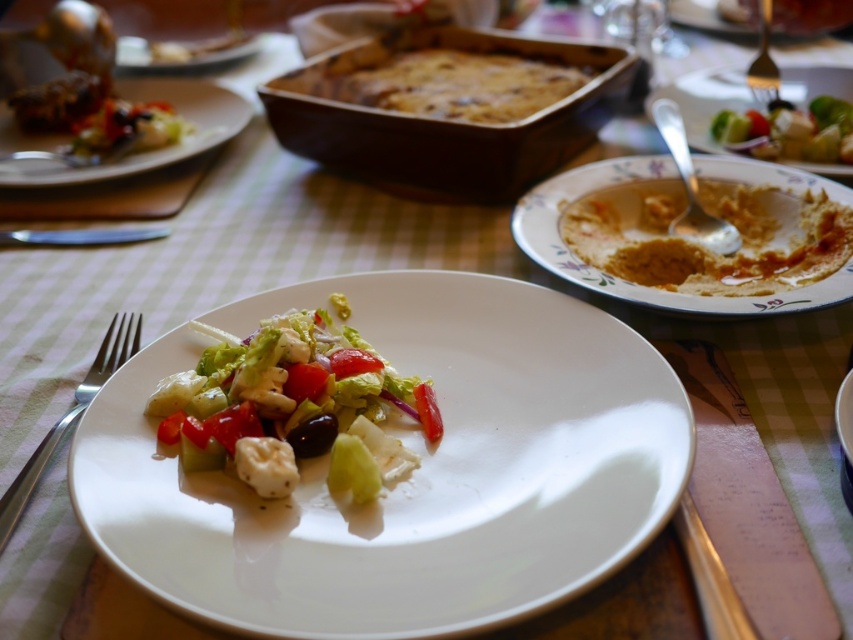
Question: Which point is closer to the camera?

Choices:
 (A) (776, 68)
 (B) (218, 113)
 (C) (676, 156)

Answer: (C)

Question: Is silver metallic fork at left bigger than satin silver fork at upper right?

Choices:
 (A) yes
 (B) no

Answer: (A)

Question: Is white glossy plate at upper left below silver metallic spoon at upper right?

Choices:
 (A) yes
 (B) no

Answer: (B)

Question: Which object appears farthest from the camera in this image?

Choices:
 (A) white ceramic plate at upper right
 (B) matte white plate at upper left
 (C) fresh green salad at upper right
 (D) floral ceramic bowl at right

Answer: (B)

Question: Which object is positioned closest to the white glossy plate at upper left?

Choices:
 (A) matte white plate at upper left
 (B) fresh green salad at center
 (C) silver metallic knife at lower left
 (D) silver metallic spoon at upper right

Answer: (A)

Question: Is white glossy plate at center below silver metallic spoon at upper right?

Choices:
 (A) yes
 (B) no

Answer: (A)